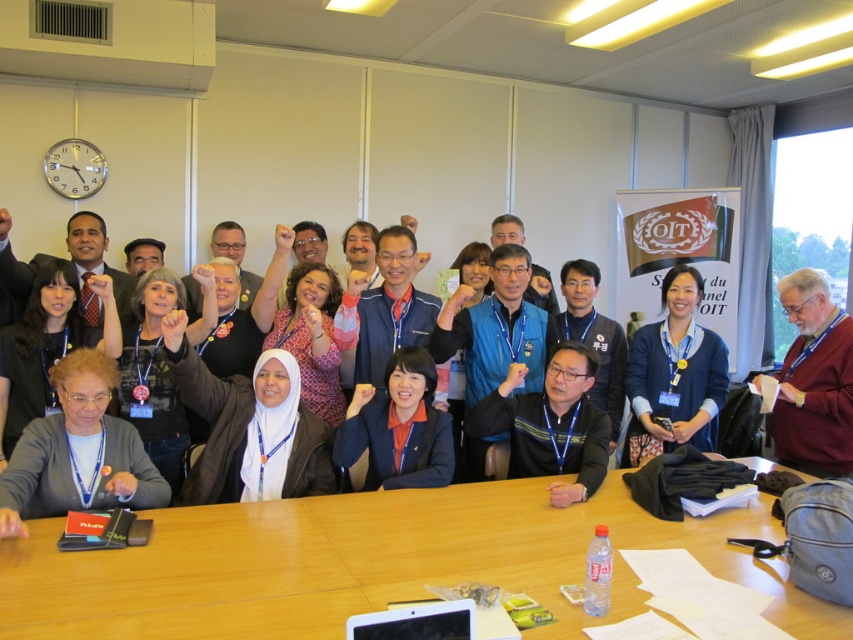
Question: Can you confirm if wooden table at center is bigger than blue sweater at center?

Choices:
 (A) yes
 (B) no

Answer: (A)

Question: Estimate the real-world distances between objects in this image. Which object is closer to the blue sweater at center?

Choices:
 (A) blue fabric jacket at center
 (B) wooden table at center
 (C) maroon sweater at right

Answer: (C)

Question: Is wooden table at center to the right of blue fabric jacket at center from the viewer's perspective?

Choices:
 (A) no
 (B) yes

Answer: (B)

Question: Among these points, which one is farthest from the camera?

Choices:
 (A) (612, 472)
 (B) (630, 378)
 (C) (815, 454)

Answer: (B)

Question: Is blue sweater at center smaller than blue fabric jacket at center?

Choices:
 (A) no
 (B) yes

Answer: (A)

Question: Among these objects, which one is nearest to the camera?

Choices:
 (A) maroon sweater at right
 (B) blue sweater at center

Answer: (A)